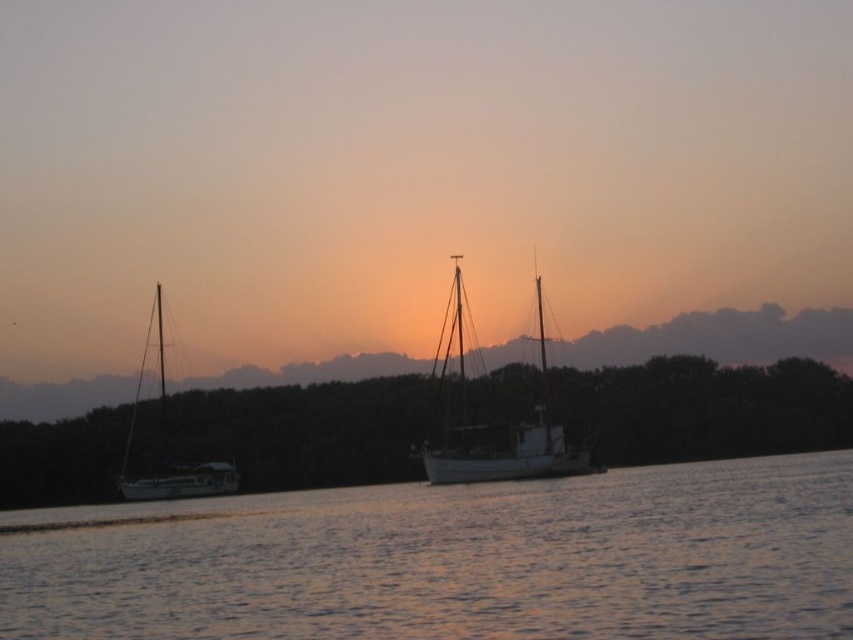
Is smooth water at center positioned in front of white matte sailboat at left?

Yes.

This screenshot has width=853, height=640. Describe the element at coordinates (453, 561) in the screenshot. I see `smooth water at center` at that location.

Find the location of a particular element. Image resolution: width=853 pixels, height=640 pixels. smooth water at center is located at coordinates (453, 561).

Who is positioned more to the left, smooth water at center or white matte sailboat at center?

smooth water at center

Does smooth water at center have a greater height compared to white matte sailboat at center?

No, smooth water at center is not taller than white matte sailboat at center.

Does point (187, 515) lie behind point (527, 442)?

No.

Locate an element on the screen. smooth water at center is located at coordinates (453, 561).

Is white matte sailboat at center positioned in front of white matte sailboat at left?

Yes, white matte sailboat at center is in front of white matte sailboat at left.

Locate an element on the screen. This screenshot has width=853, height=640. white matte sailboat at center is located at coordinates (498, 426).

The width and height of the screenshot is (853, 640). What do you see at coordinates (498, 426) in the screenshot?
I see `white matte sailboat at center` at bounding box center [498, 426].

I want to click on white matte sailboat at center, so click(x=498, y=426).